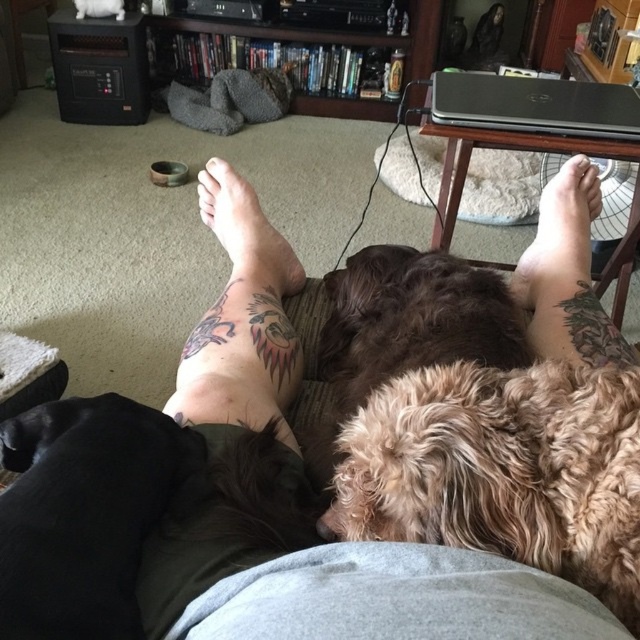
Is point (128, 404) farther from camera compared to point (582, 250)?

No.

Does point (83, 404) lie behind point (580, 211)?

No, it is not.

In order to click on black fur dog at lower left in this screenshot , I will do `click(86, 513)`.

Is black fur dog at lower left bigger than brown fur at center?

No.

Does black fur dog at lower left have a greater height compared to brown fur at center?

Incorrect, black fur dog at lower left's height is not larger of brown fur at center's.

Is point (84, 531) less distant than point (294, 596)?

That is False.

You are a GUI agent. You are given a task and a screenshot of the screen. Output one action in this format:
    pyautogui.click(x=<x>, y=<y>)
    Task: Click on the black fur dog at lower left
    The width and height of the screenshot is (640, 640).
    Given the screenshot: What is the action you would take?
    pyautogui.click(x=86, y=513)

Between point (36, 509) and point (385, 262), which one is positioned in front?

Point (36, 509) is in front.

Does point (115, 429) come behind point (333, 368)?

No, (115, 429) is closer to viewer.

Image resolution: width=640 pixels, height=640 pixels. What do you see at coordinates (86, 513) in the screenshot?
I see `black fur dog at lower left` at bounding box center [86, 513].

In order to click on black fur dog at lower left in this screenshot , I will do click(x=86, y=513).